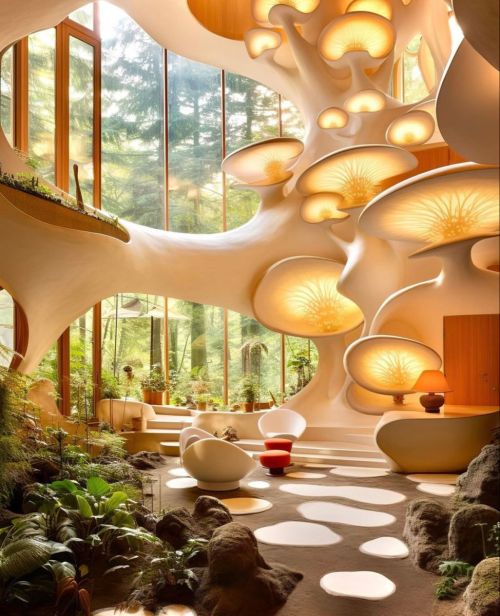
The width and height of the screenshot is (500, 616). Find the location of `lampshade`. lampshade is located at coordinates (437, 379).